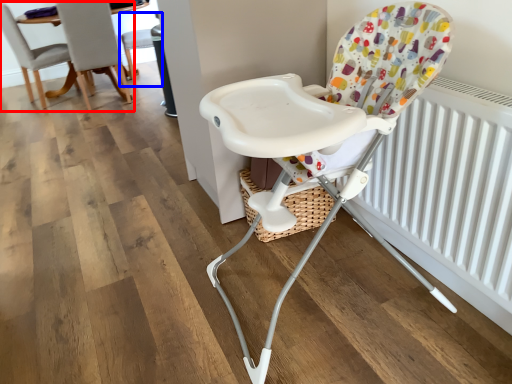
Question: Among these objects, which one is nearest to the camera, chair (highlighted by a red box) or chair (highlighted by a blue box)?

Choices:
 (A) chair
 (B) chair

Answer: (A)